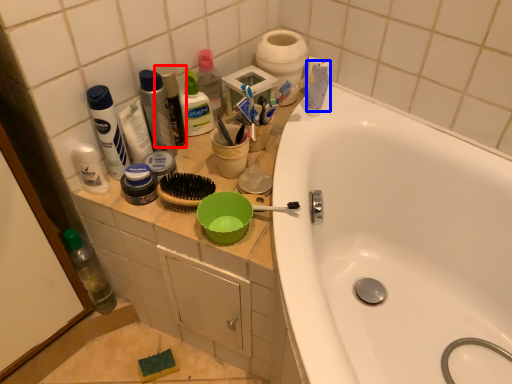
Question: Which object appears closest to the camera in this image, mouthwash (highlighted by a red box) or toothpaste (highlighted by a blue box)?

Choices:
 (A) mouthwash
 (B) toothpaste

Answer: (A)